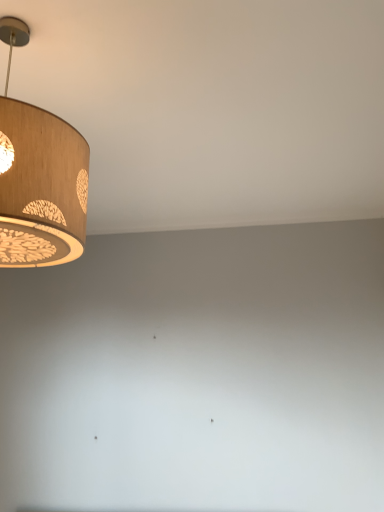
Where is `wooden lampshade at upper left`? The image size is (384, 512). wooden lampshade at upper left is located at coordinates (39, 178).

This screenshot has height=512, width=384. What do you see at coordinates (39, 178) in the screenshot?
I see `wooden lampshade at upper left` at bounding box center [39, 178].

Where is `wooden lampshade at upper left`? wooden lampshade at upper left is located at coordinates (39, 178).